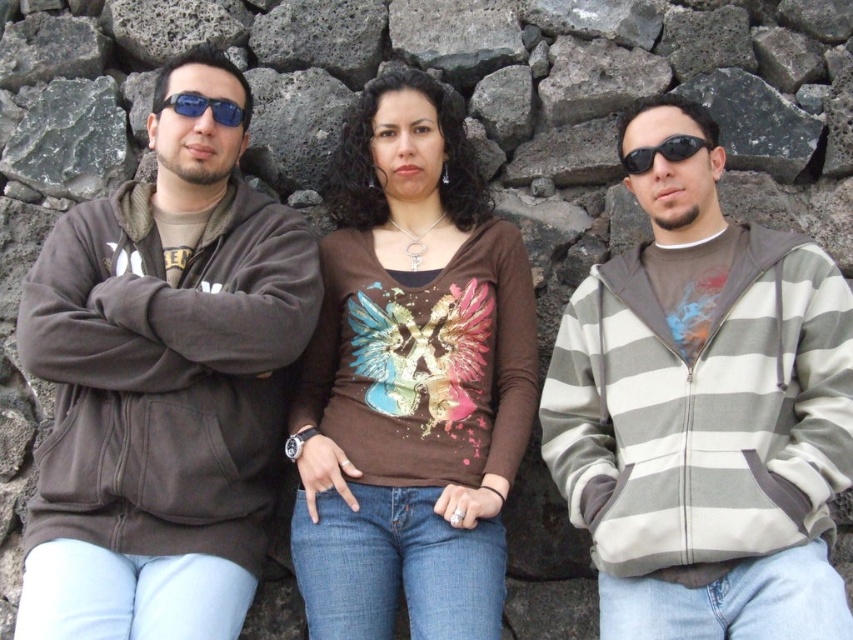
You are a photographer trying to capture a group photo of the striped fleece jacket at right and the brown matte shirt at center. The camera you are using has a maximum focus range of 6 meters. Can you take a photo that includes both subjects without moving either of them?

The distance between the striped fleece jacket at right and the brown matte shirt at center is 5.70 meters, which is within the camera maximum focus range of 6 meters. Therefore, you can take a photo that includes both subjects without moving them.

Consider the image. You are trying to decide which clothing item to take for a hike. You have a striped fleece jacket at right and a brown matte shirt at center. Based on their sizes, which one might be more suitable for colder weather?

The striped fleece jacket at right is bigger than the brown matte shirt at center, so it might provide better insulation and be more suitable for colder weather.

From the picture: You are trying to decide which item is larger between the matte brown hoodie at left and the blue reflective sunglasses at center. Based on the scene, which one is bigger?

The matte brown hoodie at left is bigger than the blue reflective sunglasses at center.